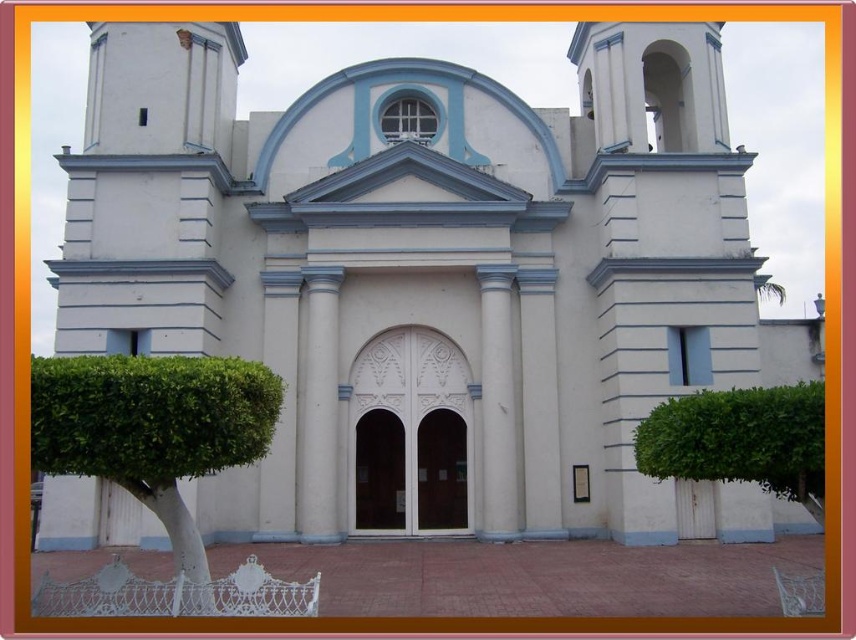
Question: Which object appears closest to the camera in this image?

Choices:
 (A) green leafy bush at right
 (B) green leafy bush at lower left

Answer: (B)

Question: Does green leafy bush at lower left appear on the right side of green leafy bush at right?

Choices:
 (A) yes
 (B) no

Answer: (B)

Question: Does green leafy bush at lower left appear on the right side of green leafy bush at right?

Choices:
 (A) yes
 (B) no

Answer: (B)

Question: Does green leafy bush at lower left appear on the right side of green leafy bush at right?

Choices:
 (A) no
 (B) yes

Answer: (A)

Question: Which of the following is the closest to the observer?

Choices:
 (A) green leafy bush at right
 (B) green leafy bush at lower left

Answer: (B)